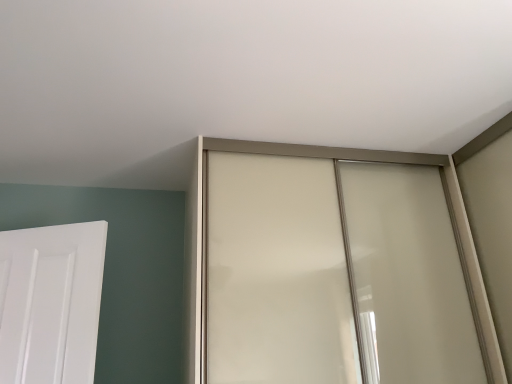
Find the location of `matte glass window at upper center`. matte glass window at upper center is located at coordinates (337, 162).

This screenshot has width=512, height=384. Describe the element at coordinates (337, 162) in the screenshot. I see `matte glass window at upper center` at that location.

Locate an element on the screen. The height and width of the screenshot is (384, 512). matte glass window at upper center is located at coordinates (337, 162).